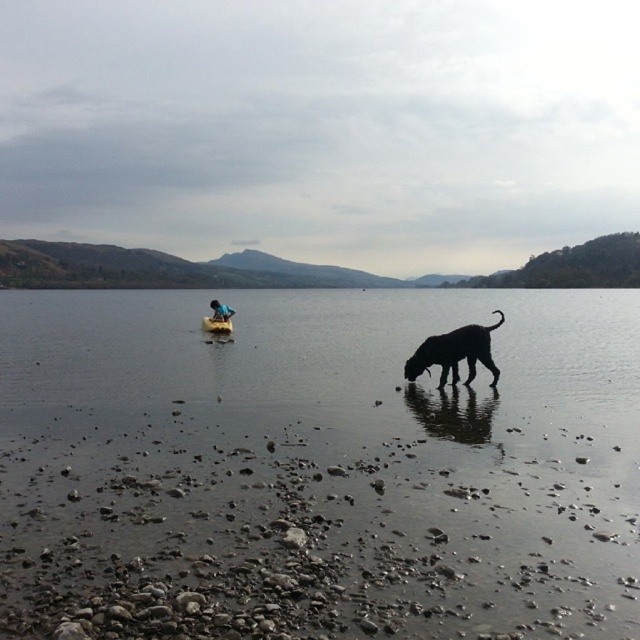
Question: Is clear water at shore center wider than wooden canoe at center?

Choices:
 (A) yes
 (B) no

Answer: (A)

Question: Among these objects, which one is nearest to the camera?

Choices:
 (A) clear water at shore center
 (B) wooden canoe at center
 (C) blue fabric at center

Answer: (A)

Question: Which point is closer to the camera?

Choices:
 (A) (467, 324)
 (B) (154, 385)

Answer: (A)

Question: Does wooden canoe at center appear on the left side of blue fabric at center?

Choices:
 (A) no
 (B) yes

Answer: (B)

Question: Is clear water at shore center to the left of black fur dog at lower center from the viewer's perspective?

Choices:
 (A) yes
 (B) no

Answer: (A)

Question: Among these points, which one is farthest from the camera?

Choices:
 (A) (108, 332)
 (B) (451, 342)

Answer: (A)